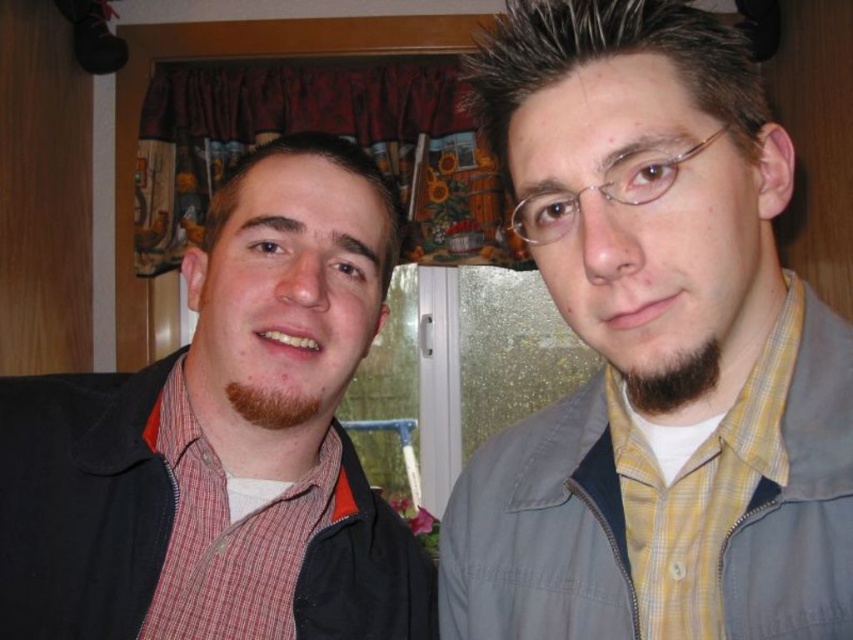
Based on the photo, you are a photographer setting up a camera to capture the two people in the scene. The yellow checkered shirt at center is at point [654,349]. Where should you position the camera to ensure both individuals are in frame?

The camera should be positioned to include both individuals, with the yellow checkered shirt at center as a central focal point, ensuring they are both visible within the frame.